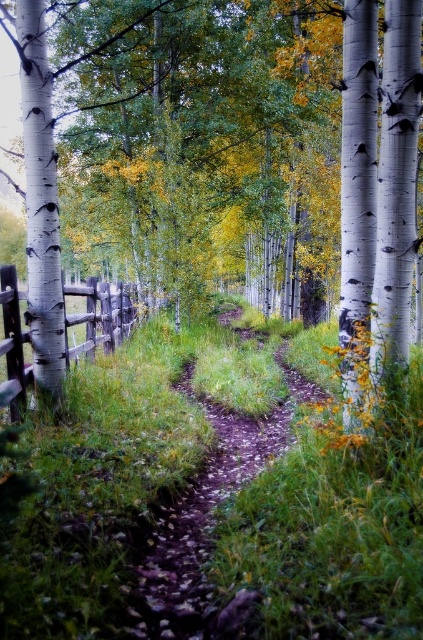
Does point (143, 248) come behind point (115, 339)?

That is True.

Does white smooth tree at center appear under brown wooden fence at left?

No.

Locate an element on the screen. white smooth tree at center is located at coordinates (249, 144).

Can you confirm if white smooth tree at center is positioned to the right of brown dirt path at center?

Incorrect, white smooth tree at center is not on the right side of brown dirt path at center.

Does white smooth tree at center come in front of brown dirt path at center?

That is True.

Locate an element on the screen. The height and width of the screenshot is (640, 423). white smooth tree at center is located at coordinates coord(249,144).

Where is `white smooth tree at center`? The width and height of the screenshot is (423, 640). white smooth tree at center is located at coordinates (249, 144).

Is brown dirt path at center further to the viewer compared to brown wooden fence at left?

→ Yes, brown dirt path at center is behind brown wooden fence at left.

Is brown dirt path at center to the left of brown wooden fence at left from the viewer's perspective?

No, brown dirt path at center is not to the left of brown wooden fence at left.

Find the location of `brown dirt path at center`. brown dirt path at center is located at coordinates (206, 516).